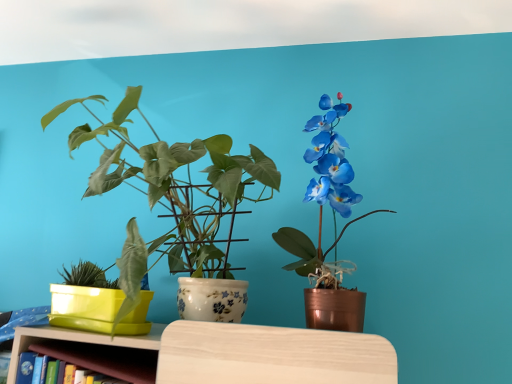
Question: In terms of width, does wooden shelf at lower left look wider or thinner when compared to matte white pot at center, which appears as the second houseplant when viewed from the right?

Choices:
 (A) thin
 (B) wide

Answer: (A)

Question: From a real-world perspective, is wooden shelf at lower left positioned above or below matte white pot at center, which appears as the second houseplant when viewed from the right?

Choices:
 (A) above
 (B) below

Answer: (B)

Question: Which object is the farthest from the matte white pot at center, which is the second houseplant from left to right?

Choices:
 (A) matte copper pot at right, the first houseplant in the right-to-left sequence
 (B) wooden shelf at lower left
 (C) matte yellow plastic pot at left, positioned as the 3th houseplant in right-to-left order

Answer: (B)

Question: Which of these objects is positioned farthest from the matte copper pot at right, the first houseplant in the right-to-left sequence?

Choices:
 (A) wooden shelf at lower left
 (B) matte white pot at center, which is the second houseplant from left to right
 (C) matte yellow plastic pot at left, the first houseplant from the left

Answer: (A)